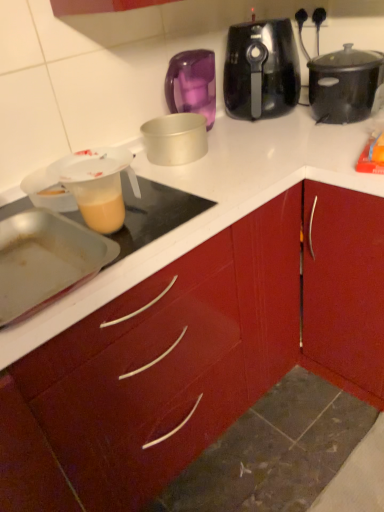
Identify the location of free space above glossy wood cabinet at center (from a real-world perspective). (234, 167).